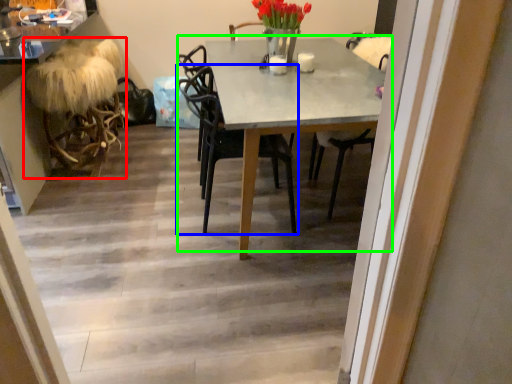
Question: Which object is positioned farthest from rocking chair (highlighted by a red box)? Select from chair (highlighted by a blue box) and kitchen & dining room table (highlighted by a green box).

Choices:
 (A) chair
 (B) kitchen & dining room table

Answer: (B)